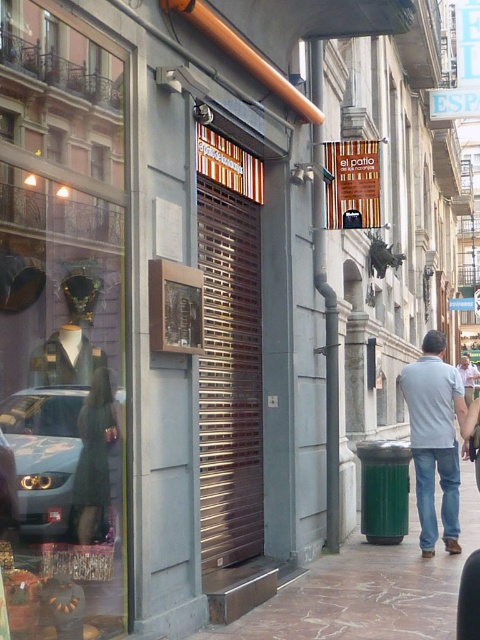
Question: Considering the real-world distances, which object is farthest from the matte black dress form at left?

Choices:
 (A) blue denim jeans at lower right
 (B) brown marble pavement at lower right

Answer: (A)

Question: Can you confirm if brown marble pavement at lower right is positioned to the left of silver metallic car at lower left?

Choices:
 (A) no
 (B) yes

Answer: (A)

Question: Estimate the real-world distances between objects in this image. Which object is closer to the silver metallic car at lower left?

Choices:
 (A) matte black dress form at left
 (B) brown marble pavement at lower right
 (C) blue denim jeans at lower right
 (D) light gray denim jeans at center

Answer: (A)

Question: From the image, what is the correct spatial relationship of brown marble pavement at lower right in relation to light gray denim jeans at center?

Choices:
 (A) above
 (B) below

Answer: (B)

Question: Can you confirm if matte black dress form at left is wider than silver metallic car at lower left?

Choices:
 (A) no
 (B) yes

Answer: (B)

Question: Which point is farther to the camera?

Choices:
 (A) (446, 476)
 (B) (358, 604)
 (C) (108, 324)

Answer: (A)